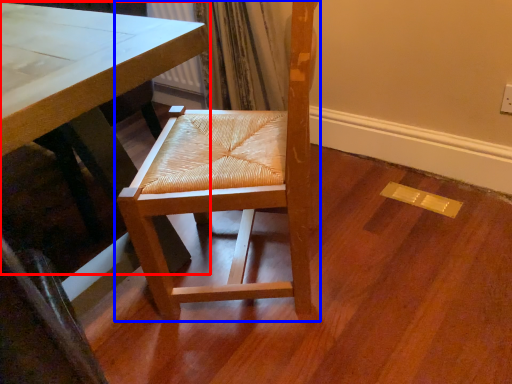
Question: Which object is closer to the camera taking this photo, table (highlighted by a red box) or chair (highlighted by a blue box)?

Choices:
 (A) table
 (B) chair

Answer: (A)